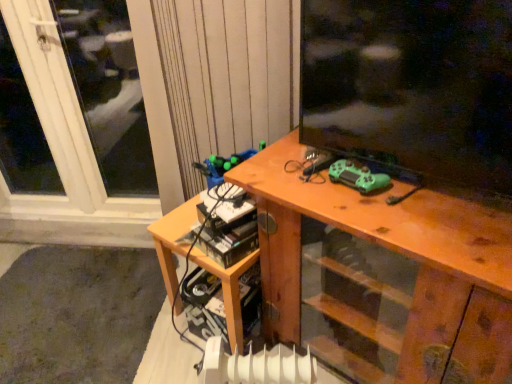
Measure the distance between green matte game controller at center and camera.

The depth of green matte game controller at center is 3.68 feet.

Image resolution: width=512 pixels, height=384 pixels. Describe the element at coordinates (73, 111) in the screenshot. I see `white plastic window at upper left` at that location.

Locate an element on the screen. white plastic radiator at lower center is located at coordinates (256, 365).

The image size is (512, 384). What do you see at coordinates (412, 85) in the screenshot? I see `matte black tv at upper right` at bounding box center [412, 85].

What do you see at coordinates (173, 240) in the screenshot? Image resolution: width=512 pixels, height=384 pixels. I see `wooden table at lower left` at bounding box center [173, 240].

Locate an element on the screen. The image size is (512, 384). wooden table at lower left is located at coordinates (173, 240).

The height and width of the screenshot is (384, 512). Identify the location of green matte game controller at center. (357, 177).

This screenshot has height=384, width=512. I want to click on equipment below the white plastic window at upper left (from the image's perspective), so click(x=357, y=177).

Which is more to the right, green matte game controller at center or white plastic window at upper left?

From the viewer's perspective, green matte game controller at center appears more on the right side.

From the image's perspective, which is below, green matte game controller at center or white plastic window at upper left?

green matte game controller at center is shown below in the image.

Which object is wider, green matte game controller at center or white plastic window at upper left?

With larger width is green matte game controller at center.

Is white plastic radiator at lower center in front of or behind matte black tv at upper right in the image?

white plastic radiator at lower center is positioned farther from the viewer than matte black tv at upper right.

Which point is more distant from viewer, (264,347) or (378,71)?

The point (264,347) is behind.

From the image's perspective, is white plastic radiator at lower center located above matte black tv at upper right?

No.

Is wooden desk at center closer to camera compared to wooden table at lower left?

Yes, it is in front of wooden table at lower left.

In terms of height, does wooden desk at center look taller or shorter compared to wooden table at lower left?

Considering their sizes, wooden desk at center has more height than wooden table at lower left.

You are a GUI agent. You are given a task and a screenshot of the screen. Output one action in this format:
    pyautogui.click(x=<x>, y=<y>)
    Task: Click on the desk on the right of wooden table at lower left
    Image resolution: width=512 pixels, height=384 pixels.
    Given the screenshot: What is the action you would take?
    pyautogui.click(x=397, y=252)

What's the angular difference between wooden desk at center and wooden table at lower left's facing directions?

0.000496 degrees separate the facing orientations of wooden desk at center and wooden table at lower left.

Which of these two, wooden desk at center or matte black tv at upper right, is bigger?

With larger size is wooden desk at center.

From the picture: Is wooden desk at center in front of or behind matte black tv at upper right in the image?

In the image, wooden desk at center appears behind matte black tv at upper right.

From the image's perspective, which one is positioned lower, wooden desk at center or matte black tv at upper right?

wooden desk at center.

In the scene shown: Can you confirm if wooden desk at center is wider than matte black tv at upper right?

Indeed, wooden desk at center has a greater width compared to matte black tv at upper right.

Is white plastic window at upper left beside wooden table at lower left?

white plastic window at upper left is not next to wooden table at lower left, and they're not touching.

Who is taller, white plastic window at upper left or wooden table at lower left?

Standing taller between the two is white plastic window at upper left.

The image size is (512, 384). I want to click on table that is in front of the white plastic window at upper left, so click(173, 240).

Considering the sizes of objects matte black tv at upper right and white plastic radiator at lower center in the image provided, who is smaller, matte black tv at upper right or white plastic radiator at lower center?

white plastic radiator at lower center.

Can we say matte black tv at upper right lies outside white plastic radiator at lower center?

Yes, matte black tv at upper right is outside of white plastic radiator at lower center.

From a real-world perspective, between white plastic radiator at lower center and white plastic window at upper left, who is vertically lower?

white plastic radiator at lower center is physically lower.

Who is bigger, white plastic radiator at lower center or white plastic window at upper left?

Bigger between the two is white plastic window at upper left.

Based on the photo, considering the sizes of objects white plastic radiator at lower center and white plastic window at upper left in the image provided, who is taller, white plastic radiator at lower center or white plastic window at upper left?

white plastic window at upper left is taller.

Which is less distant, (234, 375) or (46, 136)?

Point (234, 375) appears to be closer to the viewer than point (46, 136).

Where is `window located above the green matte game controller at center (from the image's perspective)`? window located above the green matte game controller at center (from the image's perspective) is located at coordinates (73, 111).

Identify the location of window screen above the white plastic radiator at lower center (from a real-world perspective). (412, 85).

Based on their spatial positions, is white plastic window at upper left or wooden desk at center further from white plastic radiator at lower center?

Based on the image, white plastic window at upper left appears to be further to white plastic radiator at lower center.

Looking at the image, which one is located further to wooden table at lower left, white plastic window at upper left or green matte game controller at center?

The object further to wooden table at lower left is white plastic window at upper left.

Looking at this image, from the image, which object appears to be farther from wooden table at lower left, matte black tv at upper right or wooden desk at center?

matte black tv at upper right is positioned further to the anchor wooden table at lower left.

In the scene shown: Considering their positions, is white plastic radiator at lower center positioned further to white plastic window at upper left than wooden desk at center?

white plastic radiator at lower center.

From the image, which object appears to be farther from wooden desk at center, white plastic window at upper left or white plastic radiator at lower center?

Based on the image, white plastic window at upper left appears to be further to wooden desk at center.

Considering their positions, is wooden table at lower left positioned further to wooden desk at center than white plastic window at upper left?

white plastic window at upper left.

Which object lies nearer to the anchor point matte black tv at upper right, green matte game controller at center or wooden desk at center?

The object closer to matte black tv at upper right is green matte game controller at center.

Which object lies nearer to the anchor point matte black tv at upper right, green matte game controller at center or wooden table at lower left?

green matte game controller at center is positioned closer to the anchor matte black tv at upper right.

In order to click on desk between green matte game controller at center and white plastic radiator at lower center vertically in this screenshot , I will do `click(397, 252)`.

The height and width of the screenshot is (384, 512). I want to click on table between white plastic window at upper left and green matte game controller at center in the horizontal direction, so click(173, 240).

Locate an element on the screen. The height and width of the screenshot is (384, 512). desk between matte black tv at upper right and wooden table at lower left in the vertical direction is located at coordinates (397, 252).

Image resolution: width=512 pixels, height=384 pixels. What are the coordinates of `table that lies between green matte game controller at center and white plastic radiator at lower center from top to bottom` in the screenshot? It's located at (173, 240).